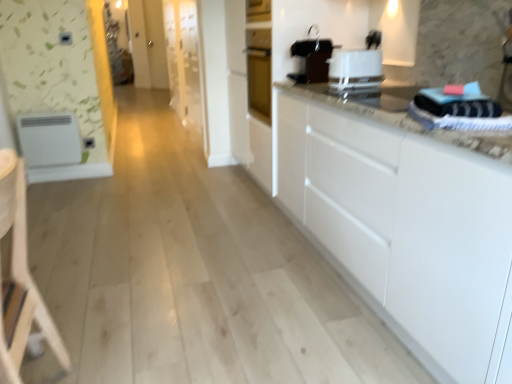
The image size is (512, 384). I want to click on vacant area on the back side of light wood armchair at left, so click(101, 349).